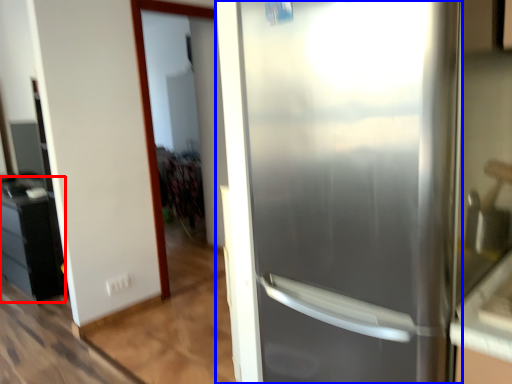
Question: Among these objects, which one is nearest to the camera, cabinetry (highlighted by a red box) or refrigerator (highlighted by a blue box)?

Choices:
 (A) cabinetry
 (B) refrigerator

Answer: (B)